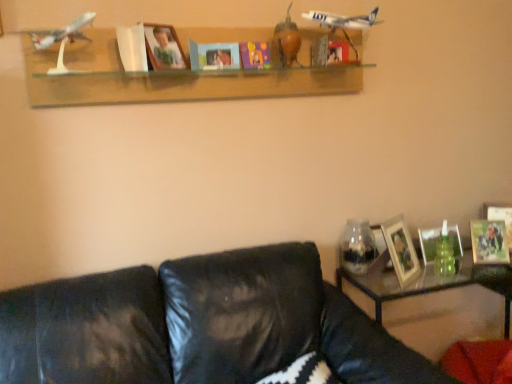
Question: Is blue matte book at center, which is counted as the second paperback book, starting from the right, looking in the opposite direction of metallic silver photo frame at right, arranged as the second picture frame when viewed from the right?

Choices:
 (A) yes
 (B) no

Answer: (B)

Question: Is blue matte book at center, which is counted as the second paperback book, starting from the right, far from metallic silver photo frame at right, arranged as the second picture frame when viewed from the right?

Choices:
 (A) no
 (B) yes

Answer: (B)

Question: Considering the relative sizes of blue matte book at center, the 2th paperback book positioned from the left, and metallic silver photo frame at right, arranged as the second picture frame when viewed from the right, in the image provided, is blue matte book at center, the 2th paperback book positioned from the left, bigger than metallic silver photo frame at right, arranged as the second picture frame when viewed from the right,?

Choices:
 (A) yes
 (B) no

Answer: (B)

Question: From the image's perspective, is blue matte book at center, which is counted as the second paperback book, starting from the right, located above metallic silver photo frame at right, which is counted as the 2th picture frame, starting from the bottom?

Choices:
 (A) no
 (B) yes

Answer: (B)

Question: Is blue matte book at center, the 2th paperback book positioned from the left, at the right side of metallic silver photo frame at right, the fourth picture frame when ordered from top to bottom?

Choices:
 (A) no
 (B) yes

Answer: (A)

Question: Considering their positions, is matte glass picture frame at right, the third picture frame positioned from the right, located in front of or behind wooden photo frame at right, which is the fifth picture frame in left-to-right order?

Choices:
 (A) front
 (B) behind

Answer: (A)

Question: From the image's perspective, is matte glass picture frame at right, the third picture frame positioned from the right, positioned above or below wooden photo frame at right, acting as the 4th picture frame starting from the bottom?

Choices:
 (A) above
 (B) below

Answer: (B)

Question: From their relative heights in the image, would you say matte glass picture frame at right, acting as the 3th picture frame starting from the top, is taller or shorter than wooden photo frame at right, the 1th picture frame from the right?

Choices:
 (A) tall
 (B) short

Answer: (B)

Question: Is matte glass picture frame at right, acting as the 3th picture frame starting from the top, to the left or to the right of wooden photo frame at right, the 1th picture frame from the right, in the image?

Choices:
 (A) left
 (B) right

Answer: (A)

Question: Considering the positions of point (371, 236) and point (253, 48), is point (371, 236) closer or farther from the camera than point (253, 48)?

Choices:
 (A) closer
 (B) farther

Answer: (B)

Question: Relative to matte purple paper at center, which ranks as the 1th paperback book in right-to-left order, is transparent glass jar at right in front or behind?

Choices:
 (A) front
 (B) behind

Answer: (B)

Question: Considering the positions of transparent glass jar at right and matte purple paper at center, which is the third paperback book in left-to-right order, in the image, is transparent glass jar at right taller or shorter than matte purple paper at center, which is the third paperback book in left-to-right order,?

Choices:
 (A) tall
 (B) short

Answer: (A)

Question: Based on their sizes in the image, would you say transparent glass jar at right is bigger or smaller than matte purple paper at center, which ranks as the 1th paperback book in right-to-left order?

Choices:
 (A) small
 (B) big

Answer: (B)

Question: From a real-world perspective, is wooden photo frame at right, placed as the fourth picture frame when sorted from right to left, physically located above or below matte purple paper at center, which ranks as the 1th paperback book in right-to-left order?

Choices:
 (A) above
 (B) below

Answer: (B)

Question: From their relative heights in the image, would you say wooden photo frame at right, which ranks as the fifth picture frame in top-to-bottom order, is taller or shorter than matte purple paper at center, which is the third paperback book in left-to-right order?

Choices:
 (A) short
 (B) tall

Answer: (B)